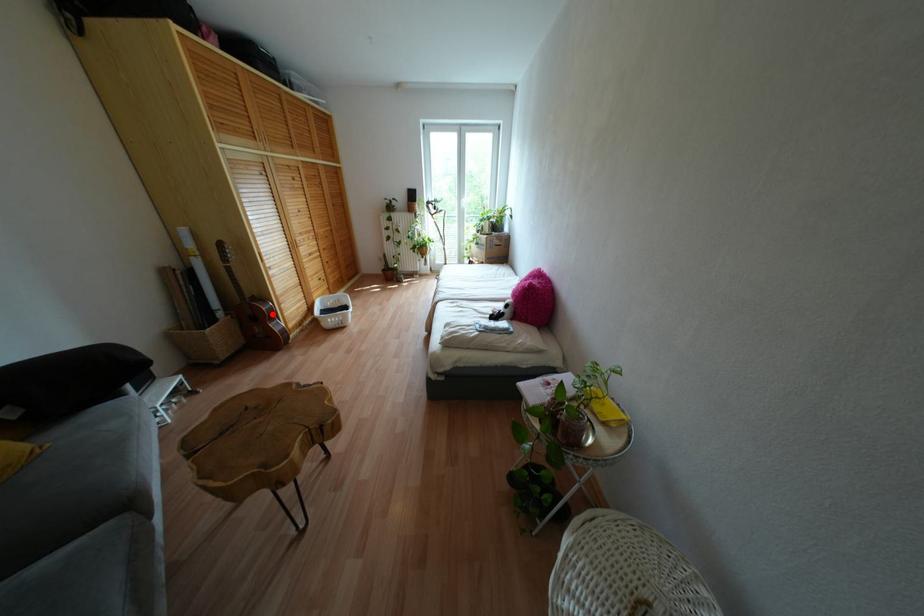
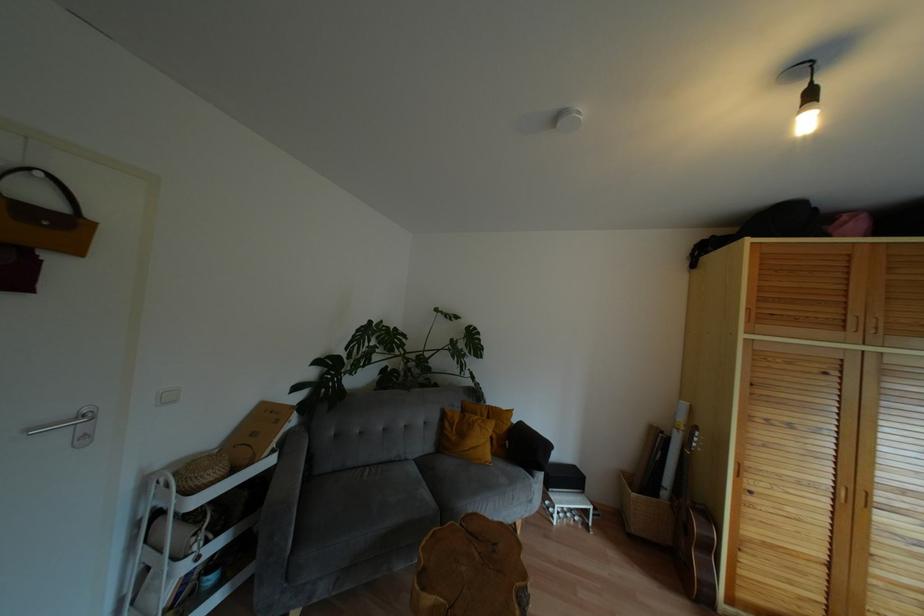
In the second image, find the point that corresponds to the highlighted location in the first image.

(710, 548)